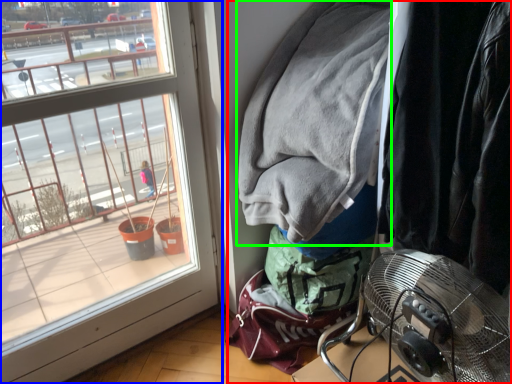
Question: Considering the real-world distances, which object is farthest from closet (highlighted by a red box)? window (highlighted by a blue box) or jacket (highlighted by a green box)?

Choices:
 (A) window
 (B) jacket

Answer: (A)